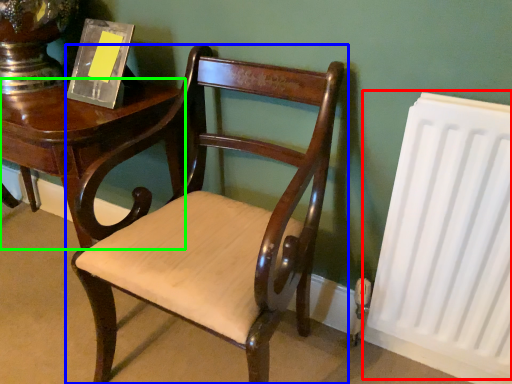
Question: Based on their relative distances, which object is farther from radiator (highlighted by a red box)? Choose from chair (highlighted by a blue box) and table (highlighted by a green box).

Choices:
 (A) chair
 (B) table

Answer: (B)